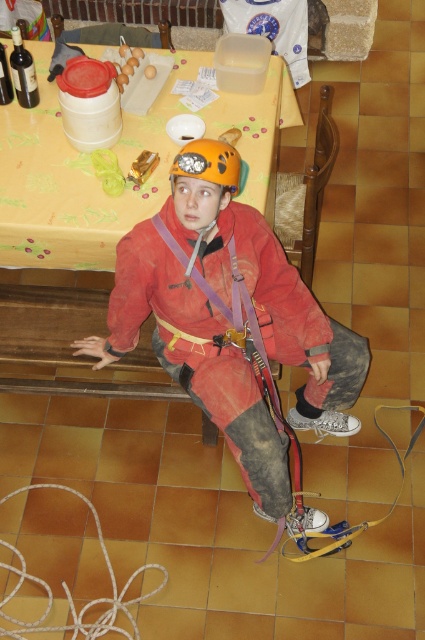
Is matte orange helmet at center smaller than orange matte helmet at center?

No, matte orange helmet at center is not smaller than orange matte helmet at center.

Between matte orange helmet at center and orange matte helmet at center, which one appears on the left side from the viewer's perspective?

orange matte helmet at center

Where is `matte orange helmet at center`? matte orange helmet at center is located at coordinates (226, 330).

This screenshot has height=640, width=425. Identify the location of matte orange helmet at center. (226, 330).

What are the coordinates of `matte orange helmet at center` in the screenshot? It's located at (226, 330).

Is point (210, 260) in front of point (113, 582)?

That is True.

Is point (138, 243) positioned after point (127, 588)?

No, it is in front of (127, 588).

Locate an element on the screen. The image size is (425, 640). matte orange helmet at center is located at coordinates [226, 330].

Does yellow plastic table at upper center appear under red matte safety vest at center?

Actually, yellow plastic table at upper center is above red matte safety vest at center.

Between yellow plastic table at upper center and red matte safety vest at center, which one has less height?

red matte safety vest at center is shorter.

Is point (119, 147) farther from viewer compared to point (240, 307)?

Yes.

What are the coordinates of `yellow plastic table at upper center` in the screenshot? It's located at (78, 177).